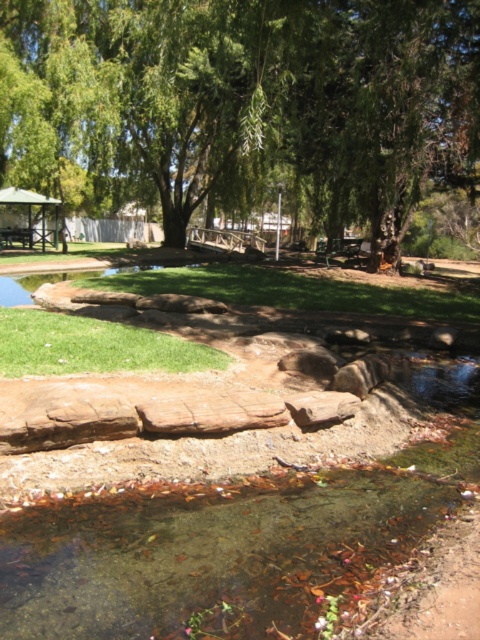
You are planning to plant a new tree in the park. The existing green leafy tree at upper center and the green grass at center are both in the area. Considering their sizes, which one should you avoid placing the new tree too close to?

You should avoid placing the new tree too close to the green leafy tree at upper center because it has a larger size and may compete for resources like sunlight and nutrients.

In the scene shown: You are planning to lay a picnic blanket in the park. The scene has two areas of green grass at center and green grass at lower left. Which area would provide a larger space for your picnic setup?

The green grass at center has a larger size compared to green grass at lower left, so it would provide a larger space for your picnic setup.